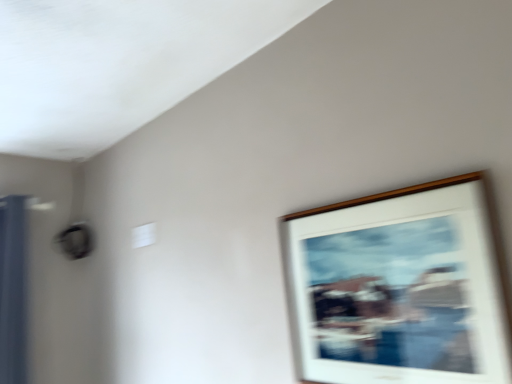
Question: Is white matte picture frame at upper right taller than blue fabric curtain at left?

Choices:
 (A) no
 (B) yes

Answer: (A)

Question: Does white matte picture frame at upper right have a smaller size compared to blue fabric curtain at left?

Choices:
 (A) no
 (B) yes

Answer: (B)

Question: Considering the relative sizes of white matte picture frame at upper right and blue fabric curtain at left in the image provided, is white matte picture frame at upper right shorter than blue fabric curtain at left?

Choices:
 (A) yes
 (B) no

Answer: (A)

Question: Is white matte picture frame at upper right thinner than blue fabric curtain at left?

Choices:
 (A) yes
 (B) no

Answer: (A)

Question: Does white matte picture frame at upper right have a greater width compared to blue fabric curtain at left?

Choices:
 (A) yes
 (B) no

Answer: (B)

Question: From a real-world perspective, is white matte picture frame at upper right beneath blue fabric curtain at left?

Choices:
 (A) yes
 (B) no

Answer: (A)

Question: Is blue fabric curtain at left placed right next to white matte picture frame at upper right?

Choices:
 (A) yes
 (B) no

Answer: (B)

Question: Does blue fabric curtain at left appear on the left side of white matte picture frame at upper right?

Choices:
 (A) yes
 (B) no

Answer: (A)

Question: Does blue fabric curtain at left have a greater height compared to white matte picture frame at upper right?

Choices:
 (A) yes
 (B) no

Answer: (A)

Question: Is the depth of blue fabric curtain at left greater than that of white matte picture frame at upper right?

Choices:
 (A) no
 (B) yes

Answer: (B)

Question: From the image's perspective, is blue fabric curtain at left over white matte picture frame at upper right?

Choices:
 (A) no
 (B) yes

Answer: (A)

Question: From the image's perspective, is blue fabric curtain at left located beneath white matte picture frame at upper right?

Choices:
 (A) yes
 (B) no

Answer: (A)

Question: From the image's perspective, relative to blue fabric curtain at left, is white matte picture frame at upper right above or below?

Choices:
 (A) below
 (B) above

Answer: (B)